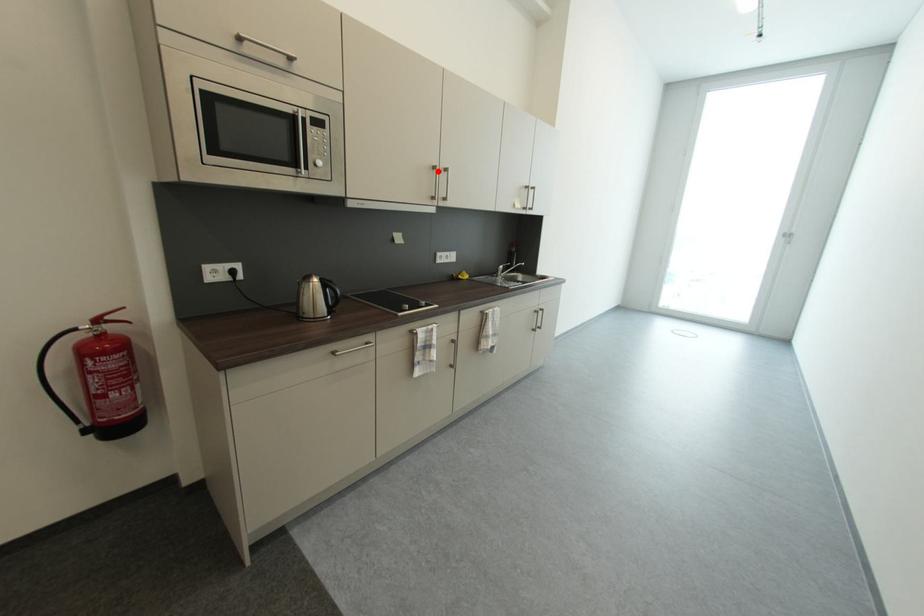
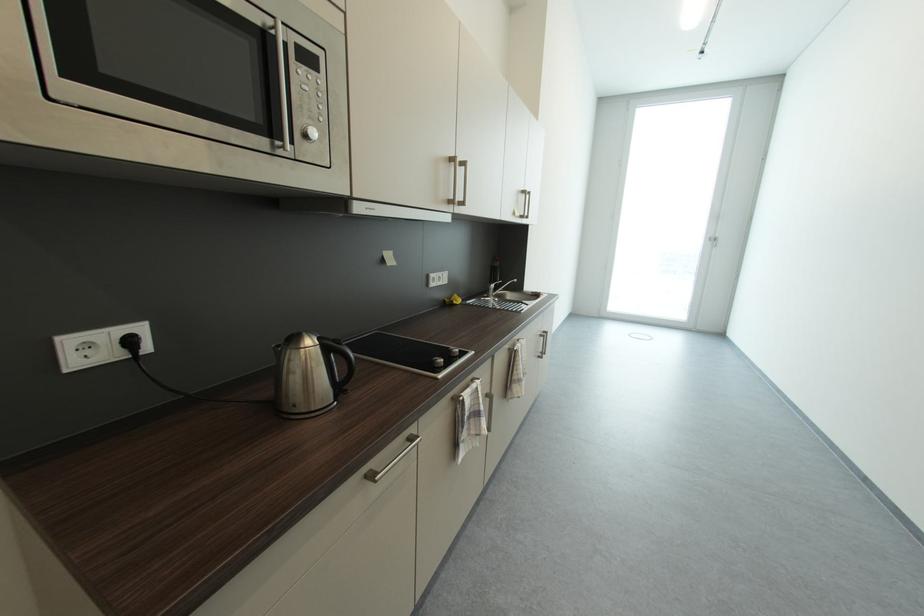
Locate, in the second image, the point that corresponds to the highlighted location in the first image.

(455, 164)